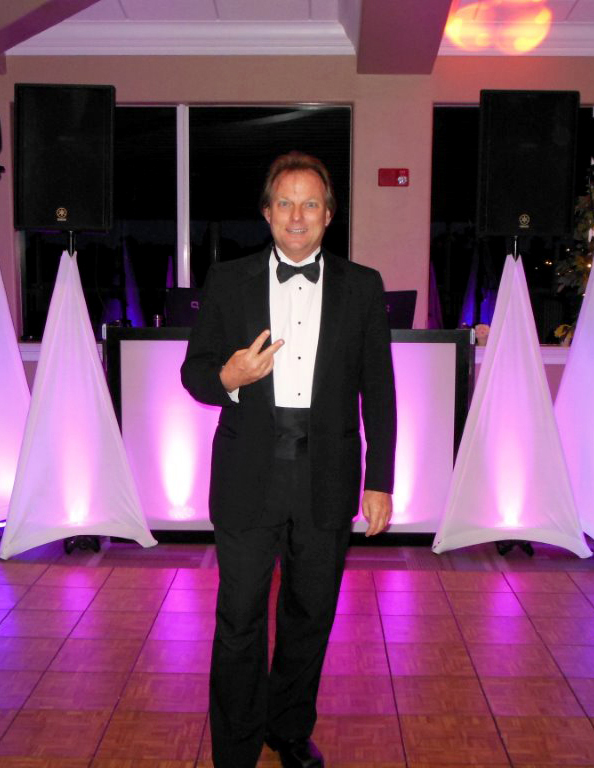
The image size is (594, 768). In order to click on small red fire alarm in this screenshot , I will do `click(391, 180)`.